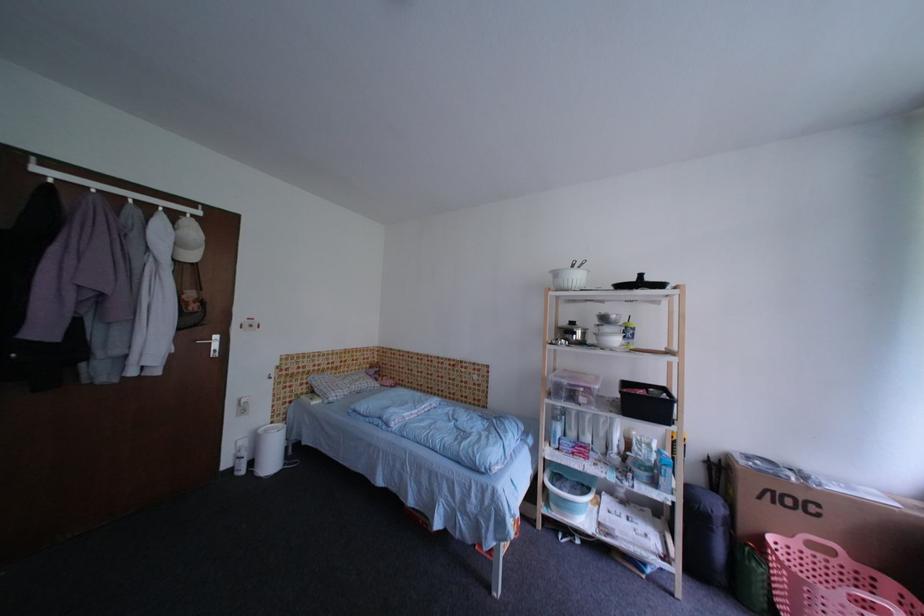
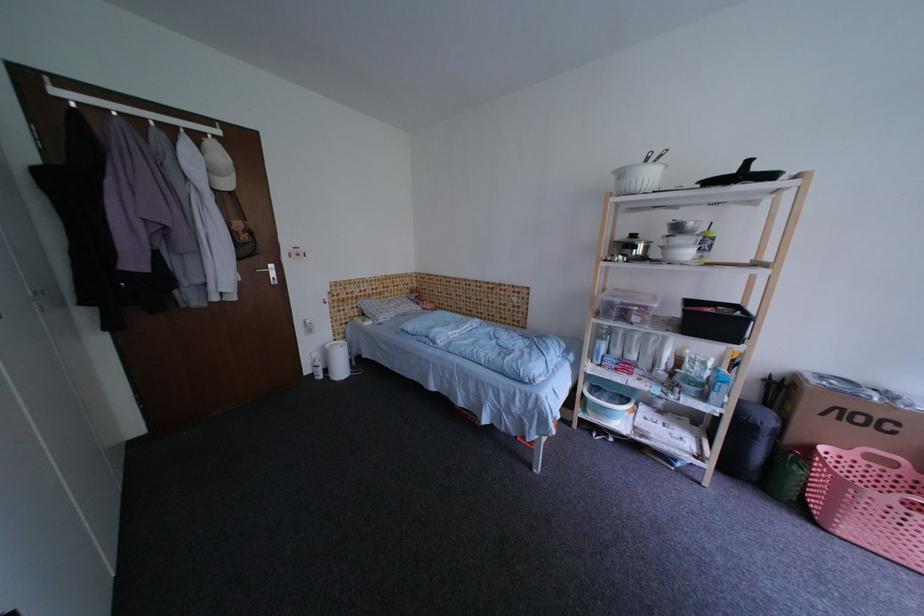
In the second image, find the point that corresponds to [580,326] in the first image.

(641, 238)